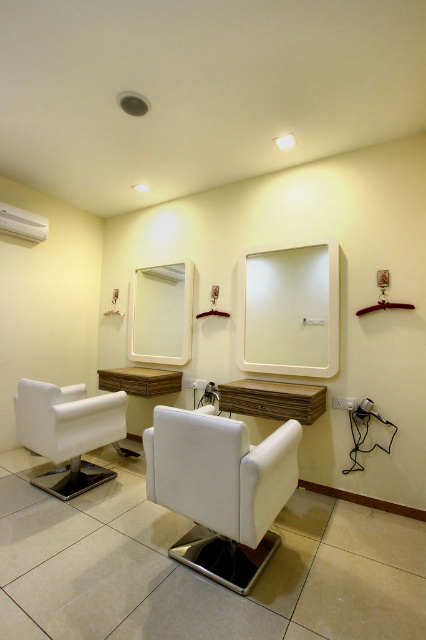
What are the coordinates of the white leather armchair at center in the image?

The white leather armchair at center is located at coordinates point [221,490].

Based on the photo, you are a photographer setting up a camera in the hair salon. You want to focus on two points in the scene, point (262,563) and point (164,339). Which point should you adjust your focus to first if you want to capture the nearest point first?

Point (262,563) is closer to the camera than point (164,339), so you should adjust your focus to point (262,563) first.